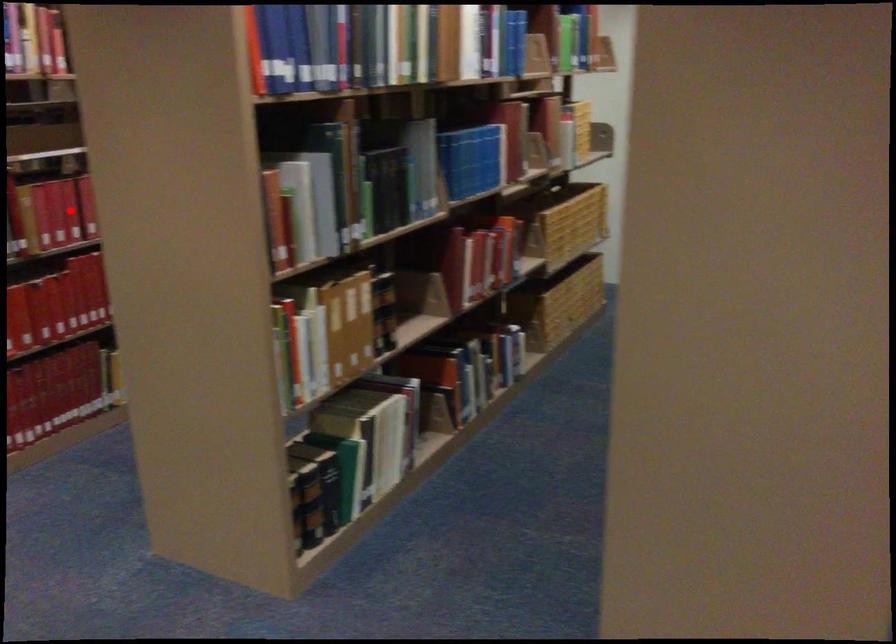
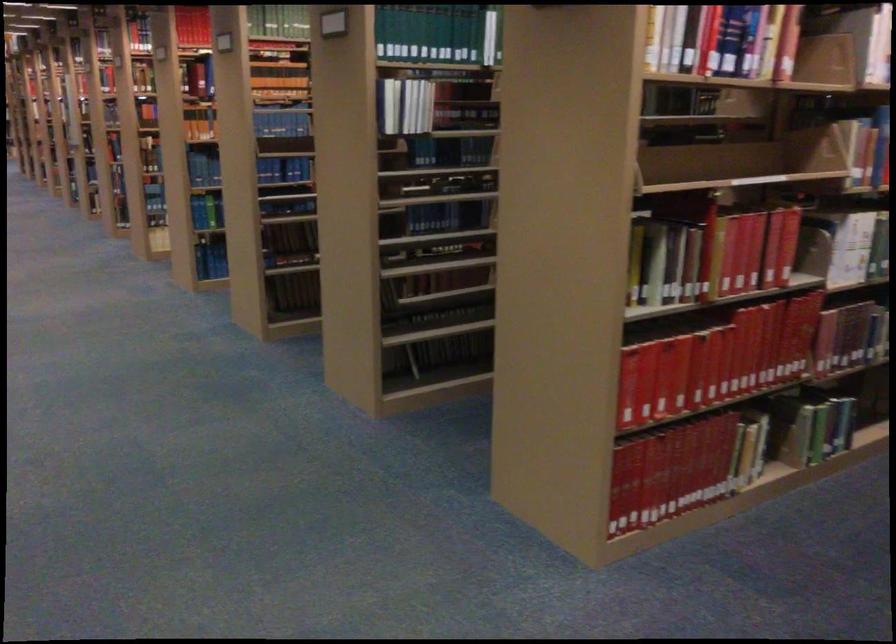
Question: I am providing you with two images of the same scene from different viewpoints. A red point is shown in image1. For the corresponding object point in image2, is it positioned nearer or farther from the camera?

Choices:
 (A) Nearer
 (B) Farther

Answer: (A)